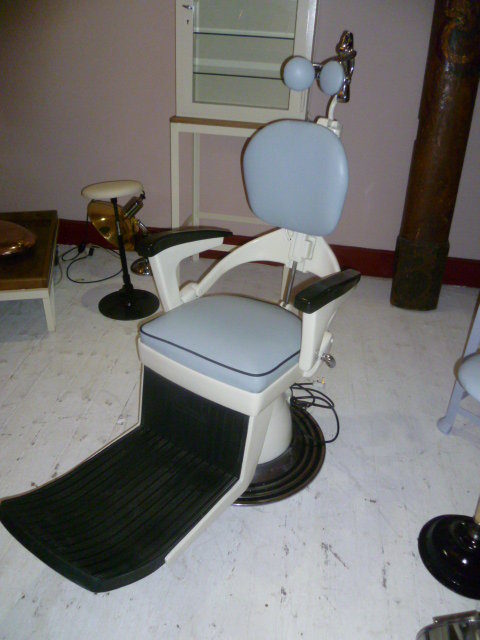
I want to click on table, so click(x=26, y=274).